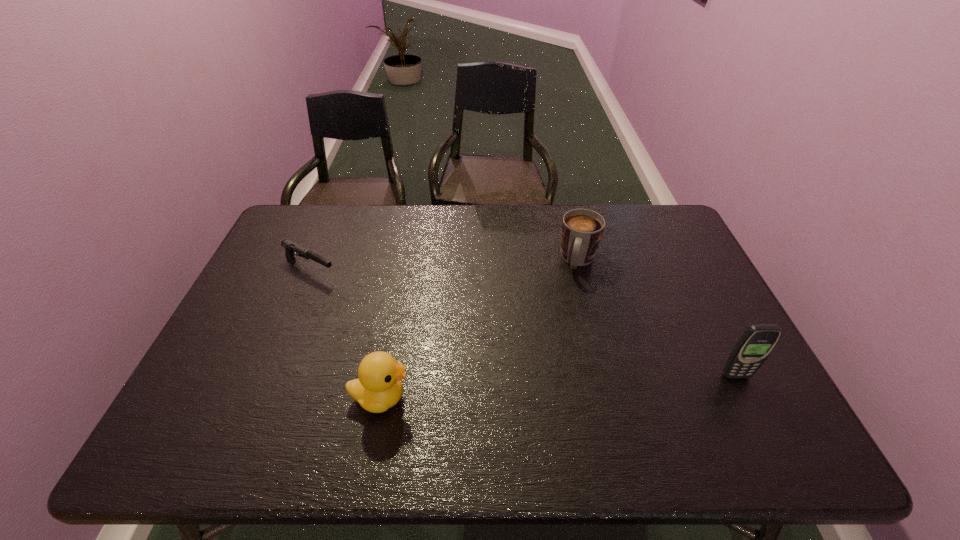
At what (x,y) coordinates should I click in order to perform the action: click on empty space between the mug and the cellular telephone. Please return your answer as a coordinate pair (x, y). The width and height of the screenshot is (960, 540). Looking at the image, I should click on (658, 318).

Where is `vacant space in between the third object from right to left and the gun`? Image resolution: width=960 pixels, height=540 pixels. vacant space in between the third object from right to left and the gun is located at coordinates (346, 334).

Locate an element on the screen. vacant area between the mug and the leftmost object is located at coordinates (444, 265).

You are a GUI agent. You are given a task and a screenshot of the screen. Output one action in this format:
    pyautogui.click(x=<x>, y=<y>)
    Task: Click on the free spot between the leftmost object and the second object from right to left
    This screenshot has height=540, width=960.
    Given the screenshot: What is the action you would take?
    pyautogui.click(x=444, y=265)

Locate an element on the screen. the third closest object relative to the second object from right to left is located at coordinates (290, 247).

What are the coordinates of `object that is the third closest to the cellular telephone` in the screenshot? It's located at (290, 247).